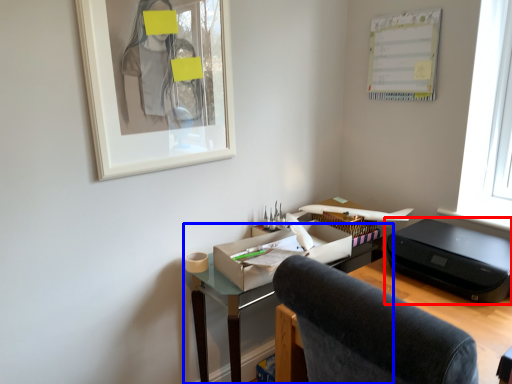
Question: Which object is further to the camera taking this photo, printer (highlighted by a red box) or desk (highlighted by a blue box)?

Choices:
 (A) printer
 (B) desk

Answer: (B)